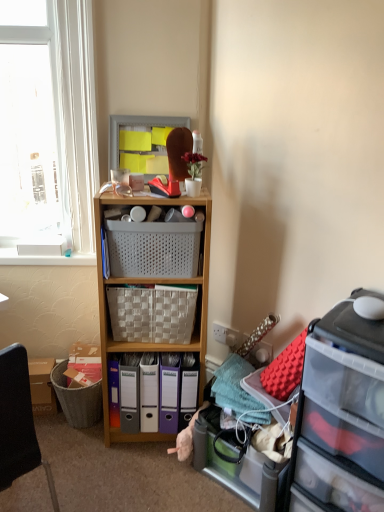
Question: Considering the relative positions of purple plastic file folders at lower center, arranged as the 3th bin when viewed from the left, and matte plastic bin at center, the second bin in the left-to-right sequence, in the image provided, is purple plastic file folders at lower center, arranged as the 3th bin when viewed from the left, to the right of matte plastic bin at center, the second bin in the left-to-right sequence, from the viewer's perspective?

Choices:
 (A) no
 (B) yes

Answer: (B)

Question: From the image's perspective, is purple plastic file folders at lower center, placed as the first bin when sorted from right to left, on top of matte plastic bin at center, which ranks as the 2th bin in right-to-left order?

Choices:
 (A) yes
 (B) no

Answer: (B)

Question: Is purple plastic file folders at lower center, placed as the first bin when sorted from right to left, positioned behind matte plastic bin at center, the second bin in the left-to-right sequence?

Choices:
 (A) yes
 (B) no

Answer: (A)

Question: Does purple plastic file folders at lower center, arranged as the 3th bin when viewed from the left, have a greater width compared to matte plastic bin at center, which ranks as the 2th bin in right-to-left order?

Choices:
 (A) yes
 (B) no

Answer: (B)

Question: Can you confirm if purple plastic file folders at lower center, arranged as the 3th bin when viewed from the left, is taller than matte plastic bin at center, the second bin in the left-to-right sequence?

Choices:
 (A) yes
 (B) no

Answer: (B)

Question: From the image's perspective, is matte plastic cabinet at upper center located above or below matte plastic bin at center, placed as the third bin when sorted from right to left?

Choices:
 (A) above
 (B) below

Answer: (A)

Question: Does point (150, 157) appear closer or farther from the camera than point (132, 386)?

Choices:
 (A) closer
 (B) farther

Answer: (A)

Question: In terms of width, does matte plastic cabinet at upper center look wider or thinner when compared to matte plastic bin at center, which appears as the 1th bin when viewed from the left?

Choices:
 (A) thin
 (B) wide

Answer: (A)

Question: Based on their positions, is matte plastic cabinet at upper center located to the left or right of matte plastic bin at center, which appears as the 1th bin when viewed from the left?

Choices:
 (A) right
 (B) left

Answer: (A)

Question: Considering the positions of white plastic window sill at upper left and matte plastic cabinet at upper center in the image, is white plastic window sill at upper left wider or thinner than matte plastic cabinet at upper center?

Choices:
 (A) wide
 (B) thin

Answer: (B)

Question: In terms of height, does white plastic window sill at upper left look taller or shorter compared to matte plastic cabinet at upper center?

Choices:
 (A) tall
 (B) short

Answer: (B)

Question: Considering the positions of white plastic window sill at upper left and matte plastic cabinet at upper center in the image, is white plastic window sill at upper left bigger or smaller than matte plastic cabinet at upper center?

Choices:
 (A) big
 (B) small

Answer: (B)

Question: From a real-world perspective, relative to matte plastic cabinet at upper center, is white plastic window sill at upper left vertically above or below?

Choices:
 (A) above
 (B) below

Answer: (B)

Question: Based on their sizes in the image, would you say matte plastic cabinet at upper center is bigger or smaller than translucent plastic storage box at lower right?

Choices:
 (A) big
 (B) small

Answer: (B)

Question: Considering their positions, is matte plastic cabinet at upper center located in front of or behind translucent plastic storage box at lower right?

Choices:
 (A) behind
 (B) front

Answer: (A)